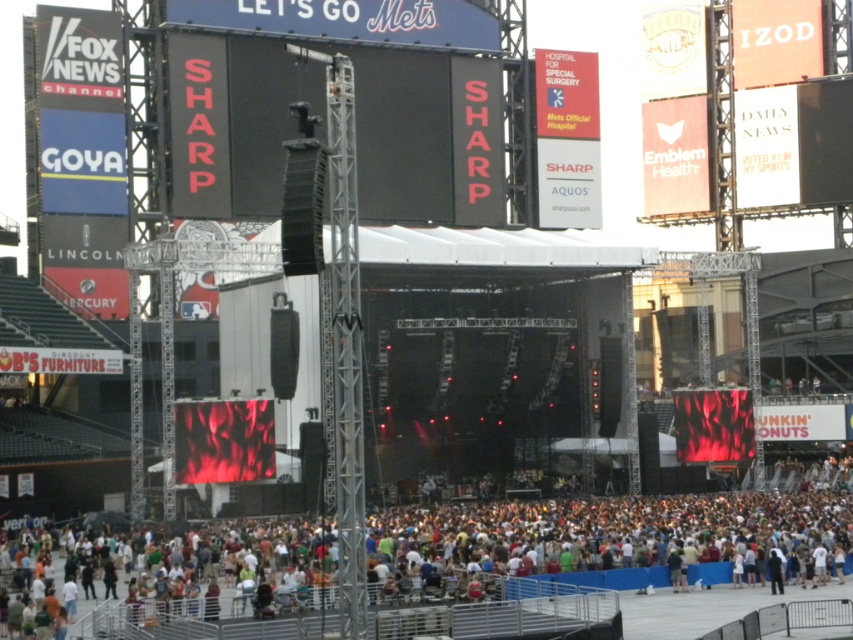
Question: Which point appears closest to the camera in this image?

Choices:
 (A) [782, 547]
 (B) [471, 90]

Answer: (A)

Question: Is multicolored fabric crowd at lower center further to camera compared to black matte scoreboard at center?

Choices:
 (A) yes
 (B) no

Answer: (B)

Question: Among these objects, which one is farthest from the camera?

Choices:
 (A) multicolored fabric crowd at lower center
 (B) black matte scoreboard at center

Answer: (B)

Question: Is multicolored fabric crowd at lower center above black matte scoreboard at center?

Choices:
 (A) yes
 (B) no

Answer: (B)

Question: Is multicolored fabric crowd at lower center bigger than black matte scoreboard at center?

Choices:
 (A) no
 (B) yes

Answer: (A)